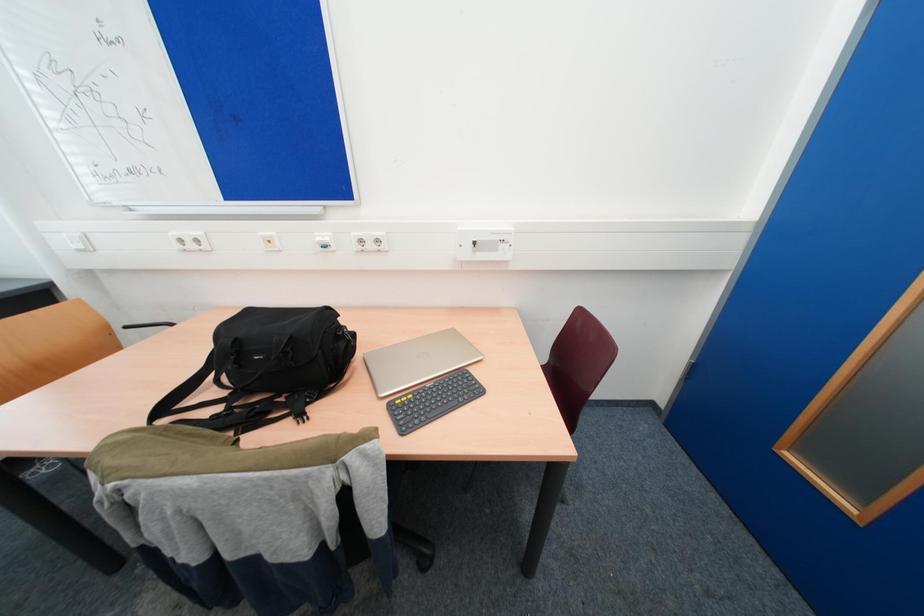
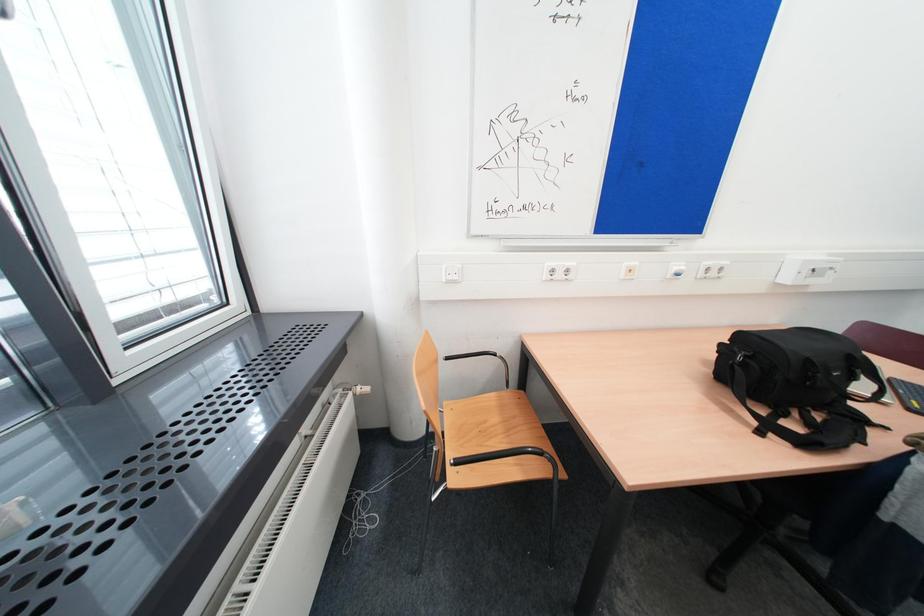
Question: What movement of the cameraman would produce the second image?

Choices:
 (A) Left
 (B) Right
 (C) Forward
 (D) Backward

Answer: (A)